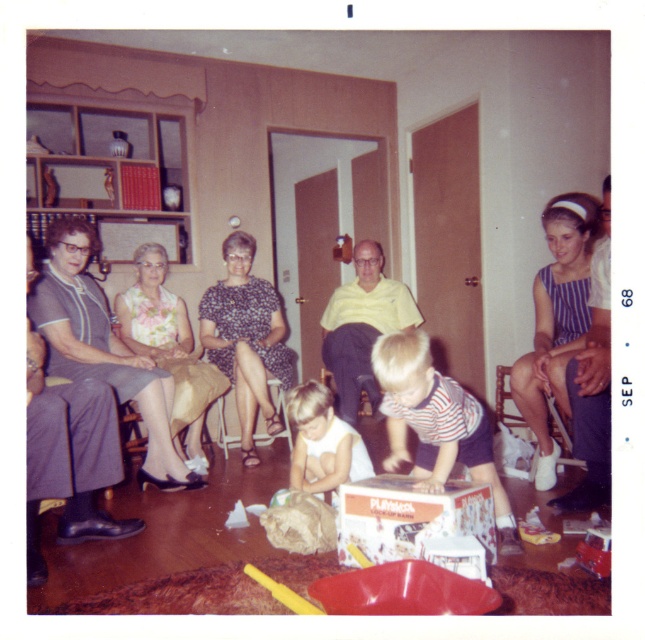
You are a guest at this family gathering and need to choose between the matte black dress at left and the matte gray dress at left. Based on their positions, which dress is closer to the window with the scalloped valance?

The matte black dress at left is closer to the window with the scalloped valance because it is positioned to the right of the matte gray dress at left, and the window is in the same area as the dresses.

You are a guest at this family gathering and need to choose a dress to wear for an upcoming event. Both the matte black dress at left and the matte gray dress at left are available. Which dress is larger in size?

The matte black dress at left is bigger than the matte gray dress at left, so it is the larger option available.